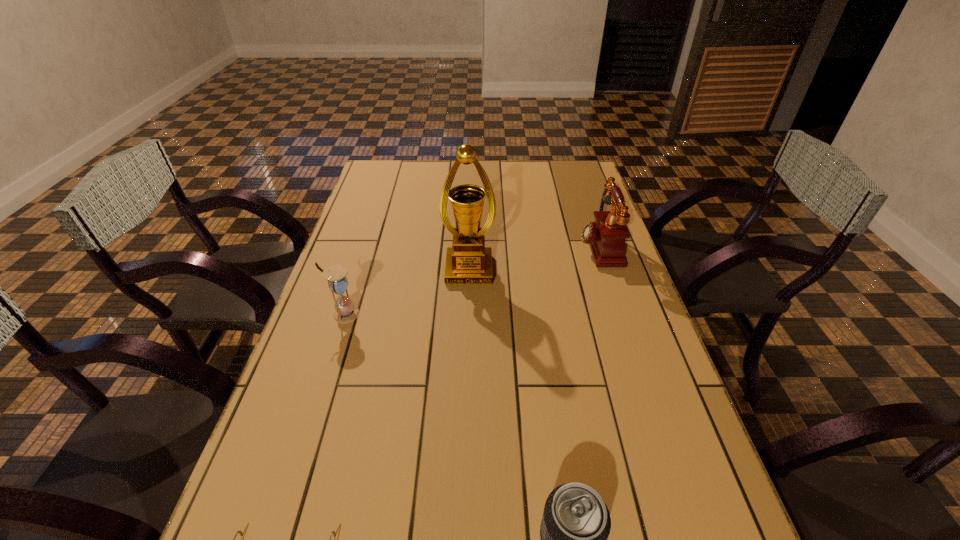
At what (x,y) coordinates should I click in order to perform the action: click on award. Please return your answer as a coordinate pair (x, y). The width and height of the screenshot is (960, 540). Looking at the image, I should click on (468, 262).

At what (x,y) coordinates should I click in order to perform the action: click on the third object from left to right. Please return your answer as a coordinate pair (x, y). The image size is (960, 540). Looking at the image, I should click on (468, 262).

Identify the location of the fourth shortest object. The height and width of the screenshot is (540, 960). (606, 236).

I want to click on telephone, so pyautogui.click(x=606, y=236).

Find the location of a particular element. the third farthest object is located at coordinates (345, 311).

What are the coordinates of `hourglass` in the screenshot? It's located at click(x=345, y=311).

The width and height of the screenshot is (960, 540). What are the coordinates of `vacant space located 0.050m on the front-facing side of the third object from right to left` in the screenshot? It's located at (468, 296).

Find the location of `vacant region located on the dial of the rightmost object`. vacant region located on the dial of the rightmost object is located at coordinates (487, 246).

I want to click on free location located 0.240m on the dial of the rightmost object, so click(x=505, y=246).

The width and height of the screenshot is (960, 540). What are the coordinates of `vacant space located 0.240m on the dial of the rightmost object` in the screenshot? It's located at (505, 246).